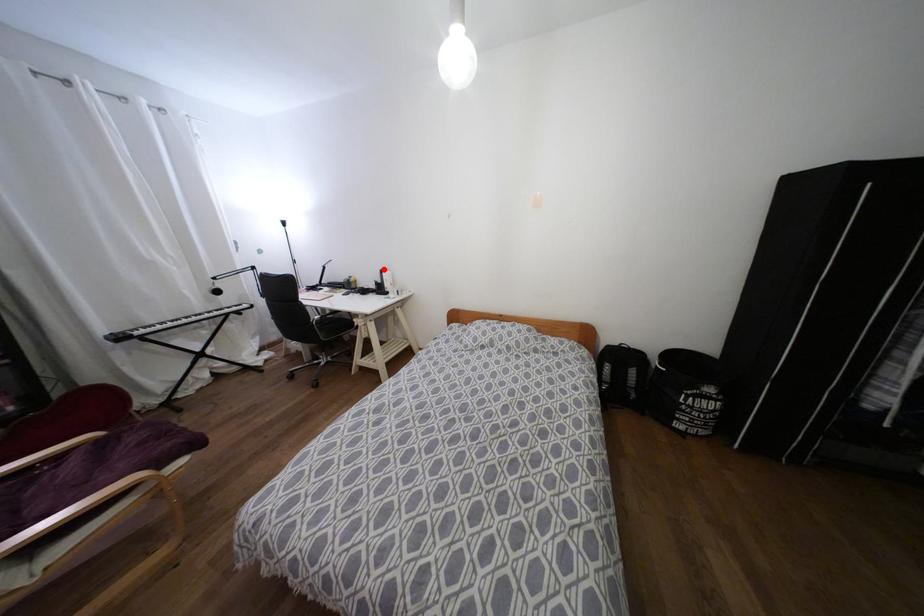
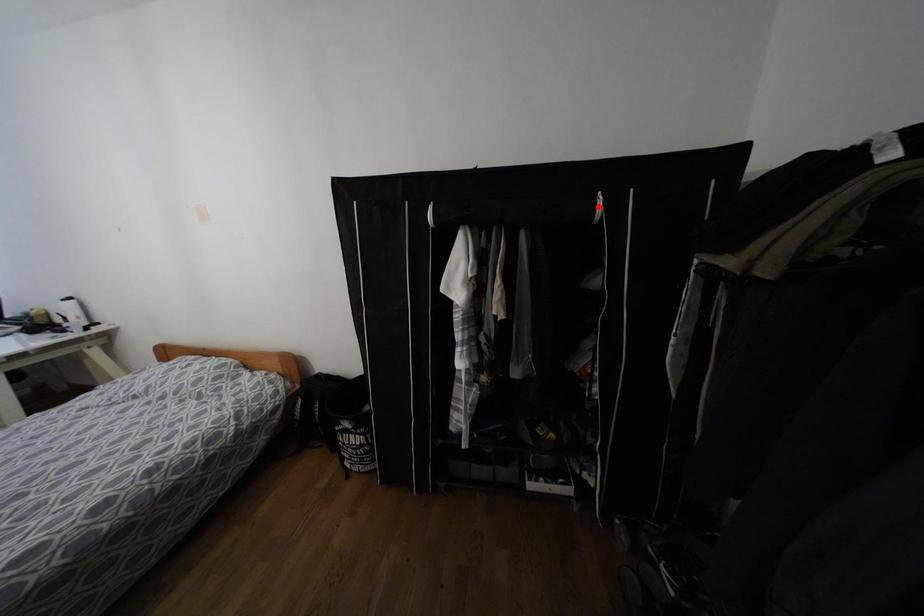
I am providing you with two images of the same scene from different viewpoints. A red point is marked on the first image and another point is marked on the second image. Are the points marked in image1 and image2 representing the same 3D position?

No